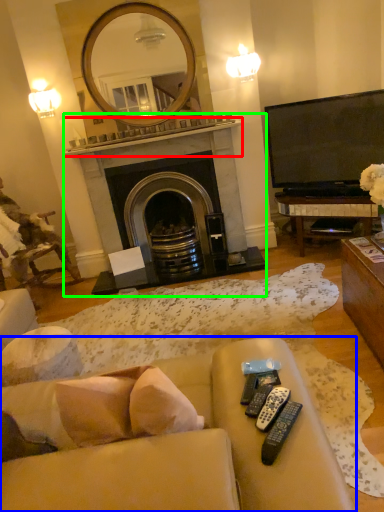
Question: Considering the real-world distances, which object is closest to mantle (highlighted by a red box)? studio couch (highlighted by a blue box) or fireplace (highlighted by a green box).

Choices:
 (A) studio couch
 (B) fireplace

Answer: (B)